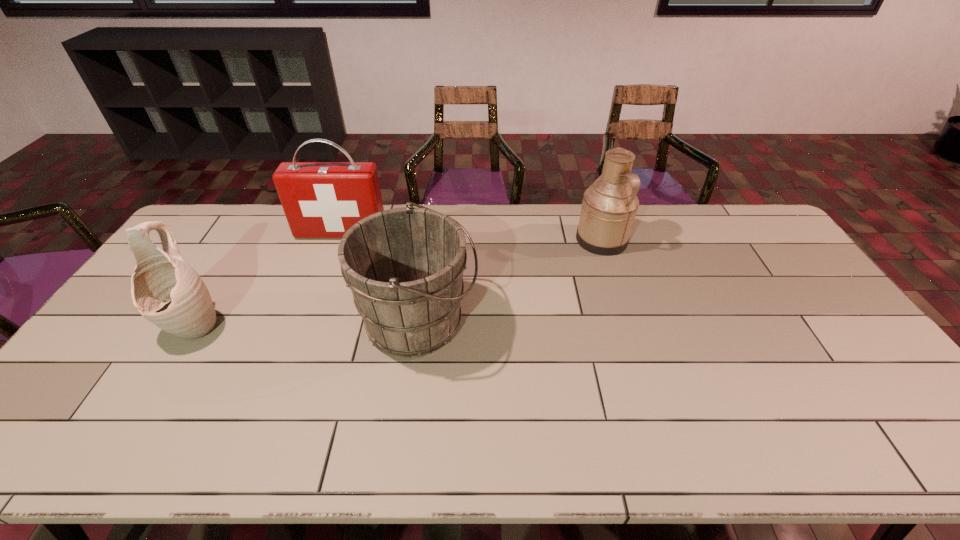
Locate an element on the screen. The height and width of the screenshot is (540, 960). free space between the first-aid kit and the rightmost object is located at coordinates (471, 237).

Where is `vacant area between the right pitcher and the bucket`? The height and width of the screenshot is (540, 960). vacant area between the right pitcher and the bucket is located at coordinates (510, 281).

Choose which object is the nearest neighbor to the left pitcher. Please provide its 2D coordinates. Your answer should be formatted as a tuple, i.e. [(x, y)], where the tuple contains the x and y coordinates of a point satisfying the conditions above.

[(320, 199)]

Point out which object is positioned as the second nearest to the right pitcher. Please provide its 2D coordinates. Your answer should be formatted as a tuple, i.e. [(x, y)], where the tuple contains the x and y coordinates of a point satisfying the conditions above.

[(320, 199)]

Where is `free point that satisfies the following two spatial constraints: 1. on the handle side of the bucket; 2. at the spout of the leftmost object`? This screenshot has width=960, height=540. free point that satisfies the following two spatial constraints: 1. on the handle side of the bucket; 2. at the spout of the leftmost object is located at coordinates (418, 326).

You are a GUI agent. You are given a task and a screenshot of the screen. Output one action in this format:
    pyautogui.click(x=<x>, y=<y>)
    Task: Click on the blank area in the image that satisfies the following two spatial constraints: 1. on the handle side of the bucket; 2. at the spout of the leftmost object
    
    Given the screenshot: What is the action you would take?
    pyautogui.click(x=418, y=326)